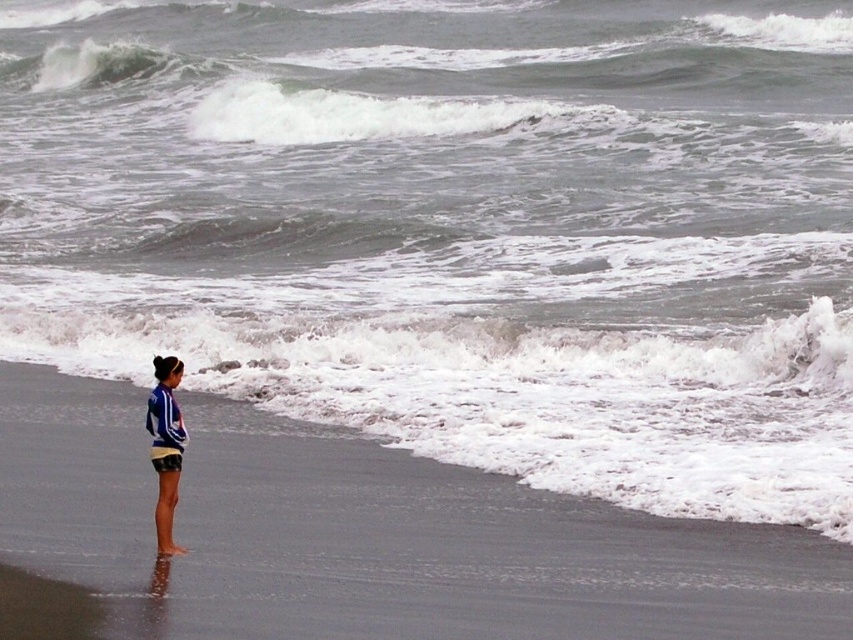
Question: Which of the following is the closest to the observer?

Choices:
 (A) (589, 621)
 (B) (151, 454)

Answer: (A)

Question: Does smooth sand beach at lower left appear under blue striped shirt at lower left?

Choices:
 (A) yes
 (B) no

Answer: (A)

Question: Which point is closer to the camera taking this photo?

Choices:
 (A) (170, 496)
 (B) (531, 547)

Answer: (A)

Question: Does smooth sand beach at lower left have a smaller size compared to blue striped shirt at lower left?

Choices:
 (A) no
 (B) yes

Answer: (A)

Question: Can you confirm if smooth sand beach at lower left is thinner than blue striped shirt at lower left?

Choices:
 (A) yes
 (B) no

Answer: (B)